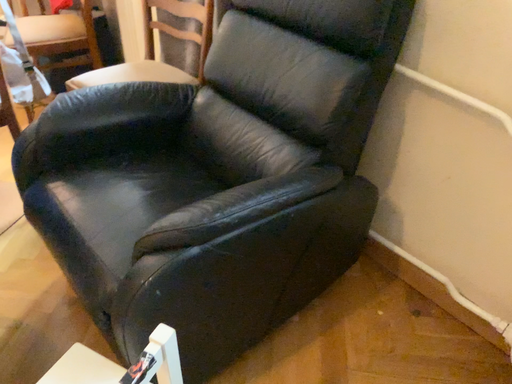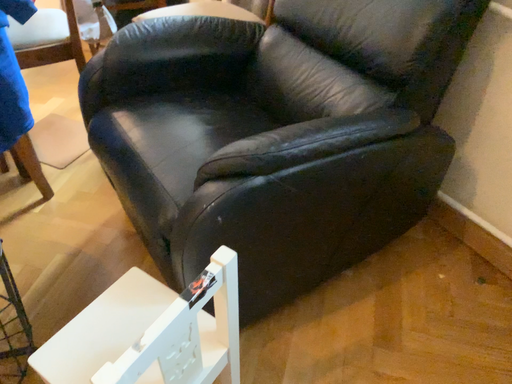
Question: How did the camera likely rotate when shooting the video?

Choices:
 (A) rotated right
 (B) rotated left

Answer: (B)